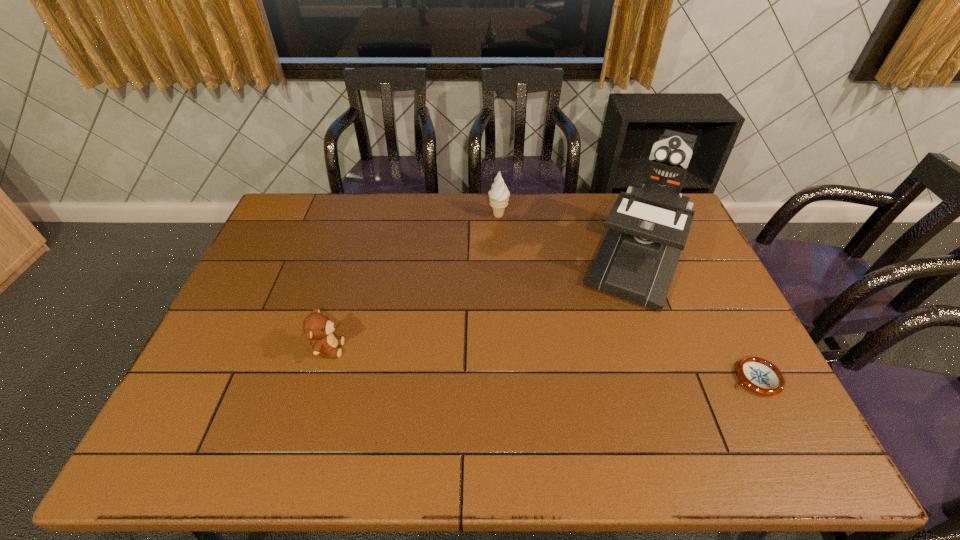
Find the location of a particular element. This screenshot has width=960, height=540. vacant space located 0.220m on the front-facing side of the third object from right to left is located at coordinates (524, 261).

Find the location of a particular element. The width and height of the screenshot is (960, 540). free space located 0.350m through the eyepieces of the tallest object is located at coordinates (x=585, y=402).

I want to click on blank area located through the eyepieces of the tallest object, so click(x=618, y=318).

I want to click on vacant space located 0.080m through the eyepieces of the tallest object, so click(x=615, y=325).

Find the location of a particular element. icecream at the far edge is located at coordinates coord(498,195).

Where is `microscope located at the far edge`? This screenshot has width=960, height=540. microscope located at the far edge is located at coordinates (648, 225).

Locate an element on the screen. Image resolution: width=960 pixels, height=540 pixels. object that is at the near edge is located at coordinates (759, 375).

Locate an element on the screen. This screenshot has height=540, width=960. compass situated at the right edge is located at coordinates click(x=759, y=375).

You are a GUI agent. You are given a task and a screenshot of the screen. Output one action in this format:
    pyautogui.click(x=<x>, y=<y>)
    Task: Click on the microscope that is at the right edge
    The image size is (960, 540).
    Given the screenshot: What is the action you would take?
    pyautogui.click(x=648, y=225)

The image size is (960, 540). I want to click on object present at the far right corner, so click(x=648, y=225).